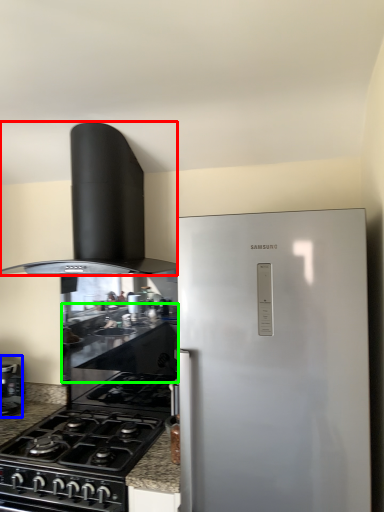
Question: Estimate the real-world distances between objects in this image. Which object is farther from home appliance (highlighted by a red box), kitchen appliance (highlighted by a blue box) or counter top (highlighted by a green box)?

Choices:
 (A) kitchen appliance
 (B) counter top

Answer: (A)